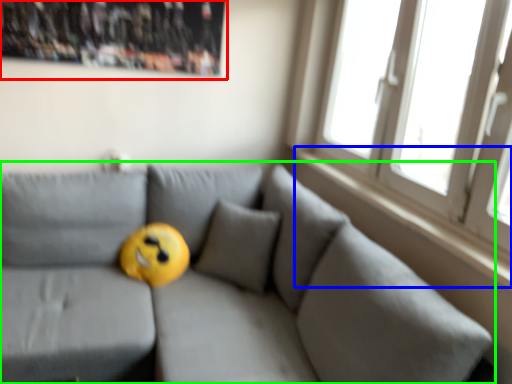
Question: Based on their relative distances, which object is farther from bulletin board (highlighted by a red box)? Choose from window sill (highlighted by a blue box) and studio couch (highlighted by a green box).

Choices:
 (A) window sill
 (B) studio couch

Answer: (A)